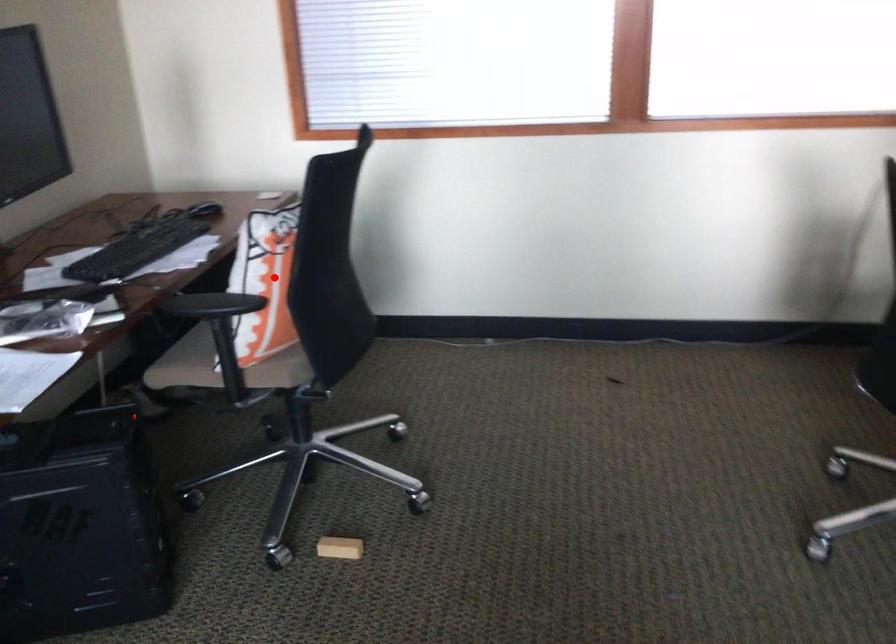
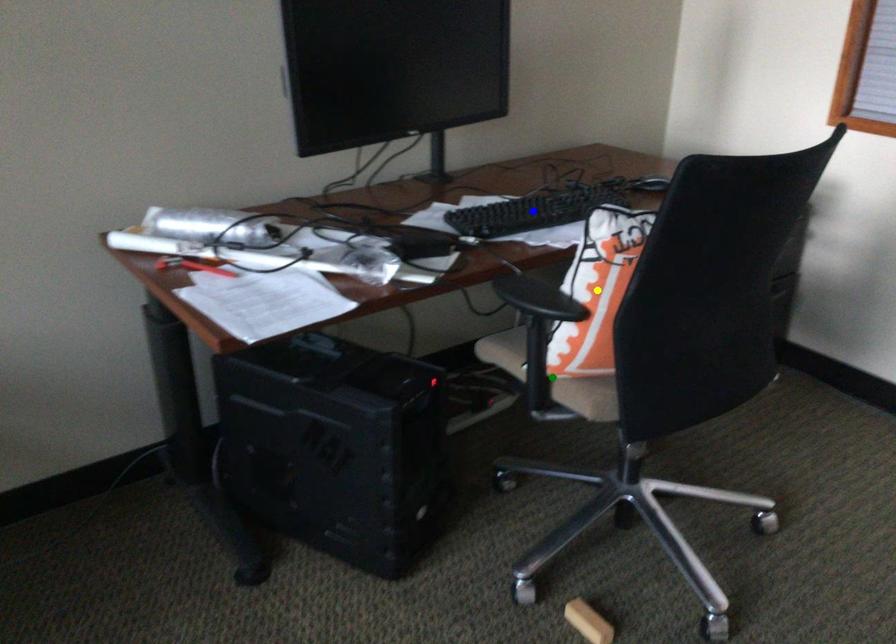
Question: I am providing you with two images of the same scene from different viewpoints. A red point is marked on the first image. You are given multiple points on the second image. In image 2, which mark is for the same physical point as the one in image 1?

Choices:
 (A) blue point
 (B) yellow point
 (C) green point

Answer: (B)